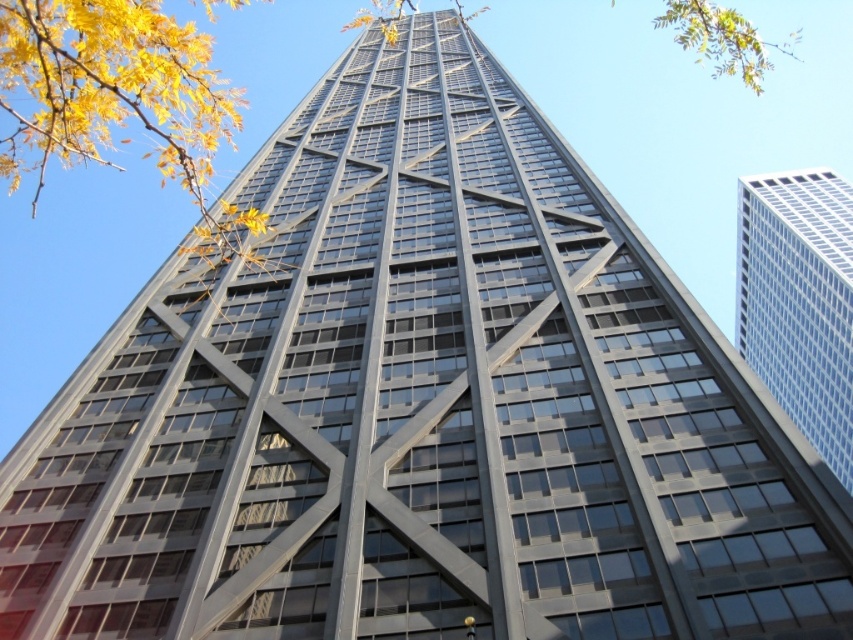
Question: Is yellow leaves at upper left positioned before white glass building at right?

Choices:
 (A) no
 (B) yes

Answer: (B)

Question: Is yellow leaves at upper left smaller than white glass building at right?

Choices:
 (A) yes
 (B) no

Answer: (B)

Question: Does yellow leaves at upper left appear on the right side of white glass building at right?

Choices:
 (A) no
 (B) yes

Answer: (A)

Question: Which point is farther to the camera?

Choices:
 (A) white glass building at right
 (B) yellow leaves at upper left

Answer: (A)